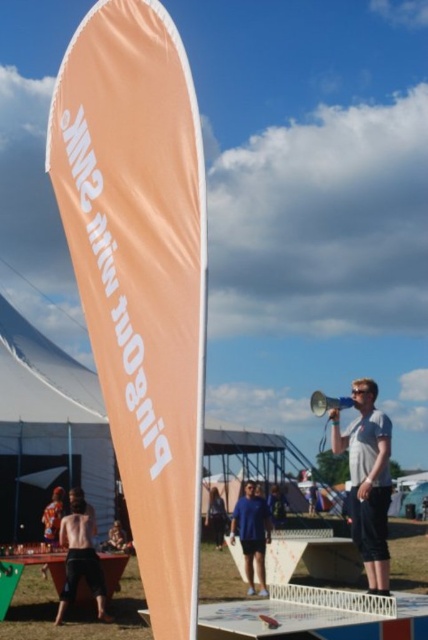
You are an event planner trying to set up a new booth. You have a large promotional banner that is 3 meters wide. The orange fabric canopy at left and the metallic silver megaphone at center are already in place. Based on their sizes, which object would allow more space for your banner to be placed next to it?

The metallic silver megaphone at center is larger than the orange fabric canopy at left. Therefore, placing the banner next to the metallic silver megaphone at center would provide more space for the banner since it occupies a bigger area, allowing the banner to be positioned alongside without overcrowding.

You are an event planner trying to set up a new booth. You have two orange fabric items, the orange fabric banner at left and the orange fabric canopy at left. Which one should you choose if you want a larger structure to provide shade for attendees?

The orange fabric canopy at left is larger than the orange fabric banner at left, so you should choose the orange fabric canopy at left to provide more shade for attendees.

You are a participant in the event and want to get a clear view of the metallic silver megaphone at center. However, there is an orange fabric canopy at left in your way. Can you move to a position where you can see the megaphone without obstruction?

The orange fabric canopy at left is located above the metallic silver megaphone at center. Therefore, you can move to a position below the canopy to see the megaphone without obstruction.